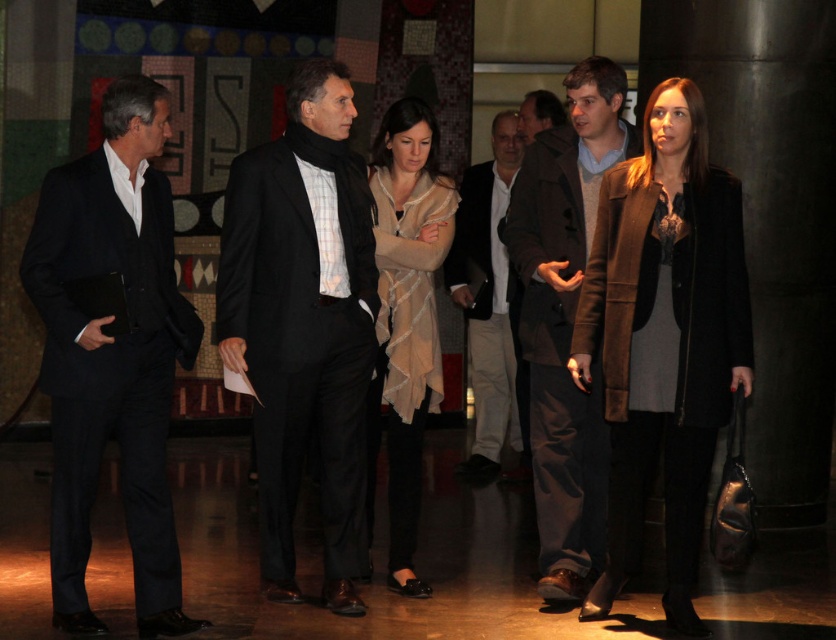
Question: Considering the real-world distances, which object is closest to the matte black suit at left?

Choices:
 (A) brown suede coat at center
 (B) light beige pants at center
 (C) beige textured coat at center

Answer: (C)

Question: Which object appears closest to the camera in this image?

Choices:
 (A) beige textured dress at center
 (B) brown suede coat at center
 (C) matte black suit at center

Answer: (C)

Question: Is brown wool coat at right positioned at the back of beige textured dress at center?

Choices:
 (A) yes
 (B) no

Answer: (B)

Question: Which of the following is the farthest from the observer?

Choices:
 (A) brown leather jacket at center
 (B) beige textured dress at center

Answer: (A)

Question: Can you confirm if beige textured coat at center is positioned to the left of beige textured dress at center?

Choices:
 (A) no
 (B) yes

Answer: (B)

Question: Is brown suede coat at center to the left of light beige pants at center from the viewer's perspective?

Choices:
 (A) yes
 (B) no

Answer: (B)